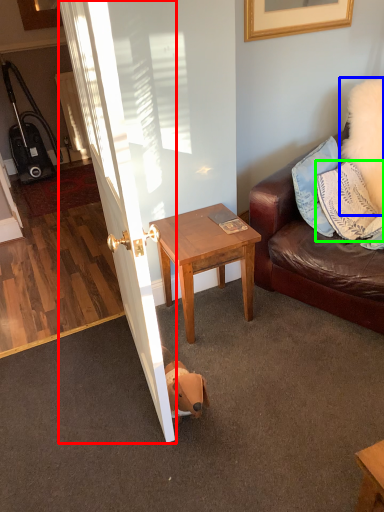
Question: Considering the real-world distances, which object is farthest from door (highlighted by a red box)? pillow (highlighted by a blue box) or pillow (highlighted by a green box)?

Choices:
 (A) pillow
 (B) pillow

Answer: (A)